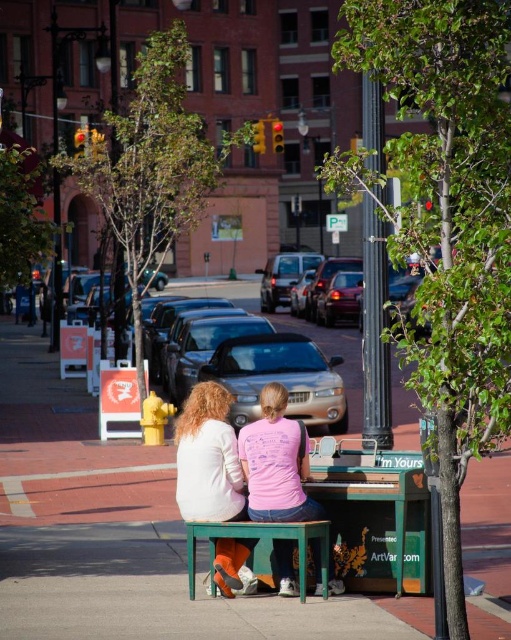
What object is located at the coordinates point (x=377, y=518) in the image?

The object at point (x=377, y=518) is the green matte piano at center.

What is located at the coordinates point (94, 520) in the image?

The green wooden bench at center is located at point (94, 520).